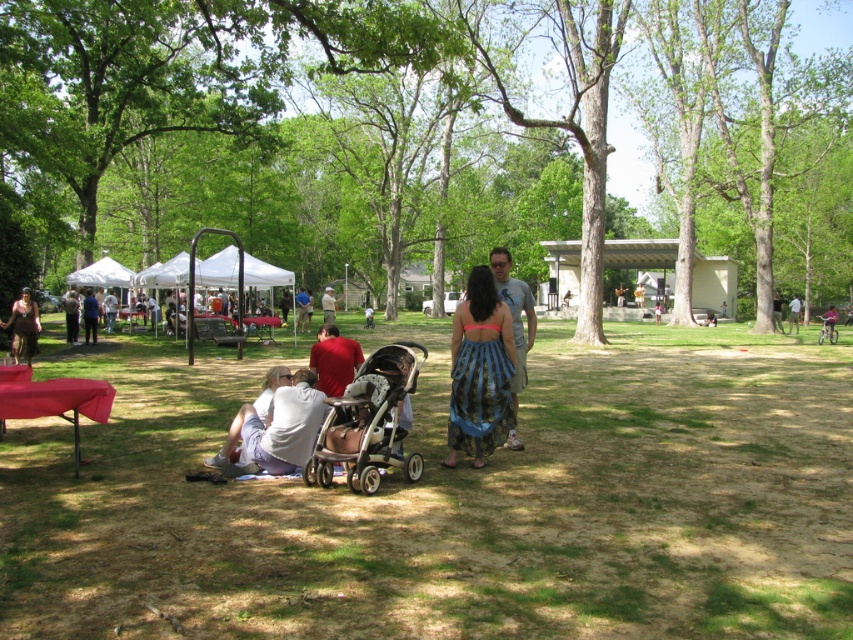
You are standing in the park and want to take a photo of both point [281,212] and point [222,452] in the scene. Which point should you focus on first to ensure both are in clear view?

You should focus on point [281,212] first because it is closer to you than point [222,452], ensuring both points are in focus when using depth of field.

You are standing in the park and want to find a spot to sit under the shade. You see the green grass at lower left and the white fabric canopy at left. Which object is located to the right of the other?

The green grass at lower left is to the right of the white fabric canopy at left.

In the scene shown: You are planning to set up a picnic area in the park. You have a picnic blanket that is 2 meters wide. You see the green grass at lower left and the white fabric canopy at left. Which location would be more suitable for laying your blanket without it hanging off the edge?

The green grass at lower left has a larger width than the white fabric canopy at left, so it would be more suitable for laying the picnic blanket without it hanging off the edge since the grass area is wider.